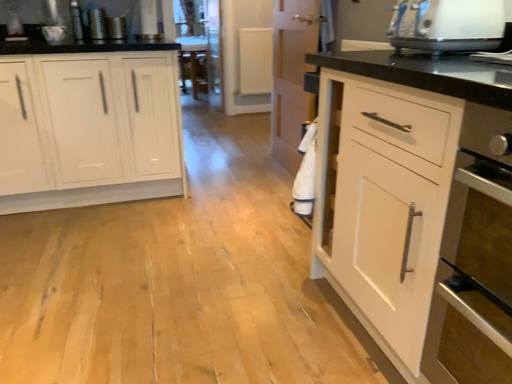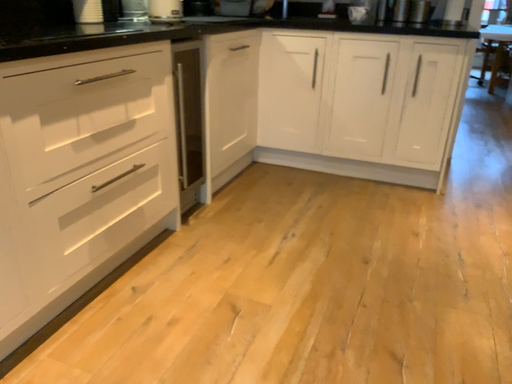
Question: Which way did the camera rotate in the video?

Choices:
 (A) rotated right
 (B) rotated left

Answer: (B)